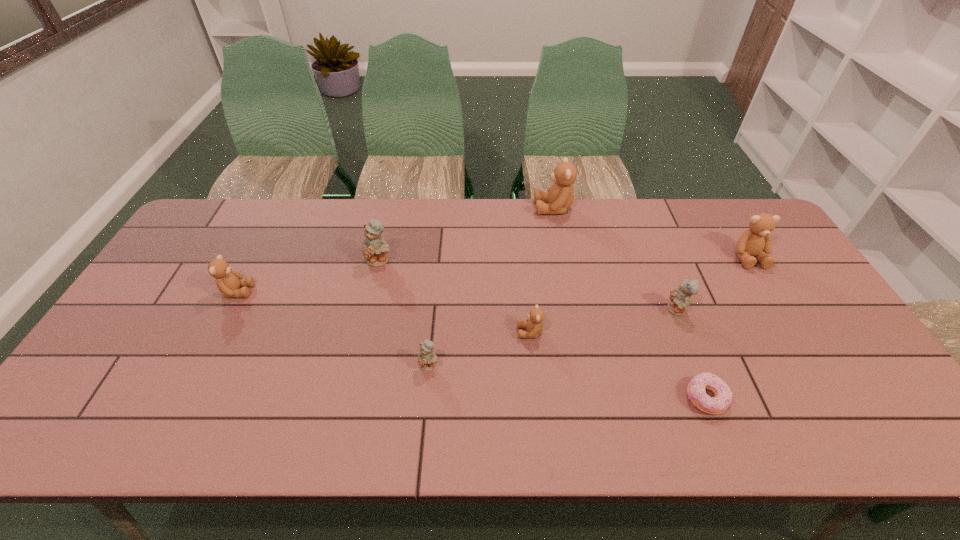
Where is `the fourth teddy bear from right to left`? Image resolution: width=960 pixels, height=540 pixels. the fourth teddy bear from right to left is located at coordinates (534, 325).

Where is `the smallest brown teddy bear`? Image resolution: width=960 pixels, height=540 pixels. the smallest brown teddy bear is located at coordinates (534, 325).

At what (x,y) coordinates should I click in order to perform the action: click on the nearest blue teddy bear. Please return your answer as a coordinate pair (x, y). Looking at the image, I should click on (427, 359).

Locate an element on the screen. The width and height of the screenshot is (960, 540). the third teddy bear from left to right is located at coordinates (427, 359).

Identify the location of doughnut. The image size is (960, 540). (696, 392).

Locate an element on the screen. The height and width of the screenshot is (540, 960). the nearest object is located at coordinates (696, 392).

Locate an element on the screen. free space located 0.090m on the face of the fourth object from right to left is located at coordinates (509, 208).

This screenshot has height=540, width=960. In order to click on vacant area located 0.060m on the face of the fourth object from right to left in this screenshot , I will do `click(517, 208)`.

Locate an element on the screen. This screenshot has height=540, width=960. vacant space located 0.150m on the face of the fourth object from right to left is located at coordinates (492, 208).

Locate an element on the screen. The image size is (960, 540). vacant space located 0.380m on the front-facing side of the biggest blue teddy bear is located at coordinates (353, 377).